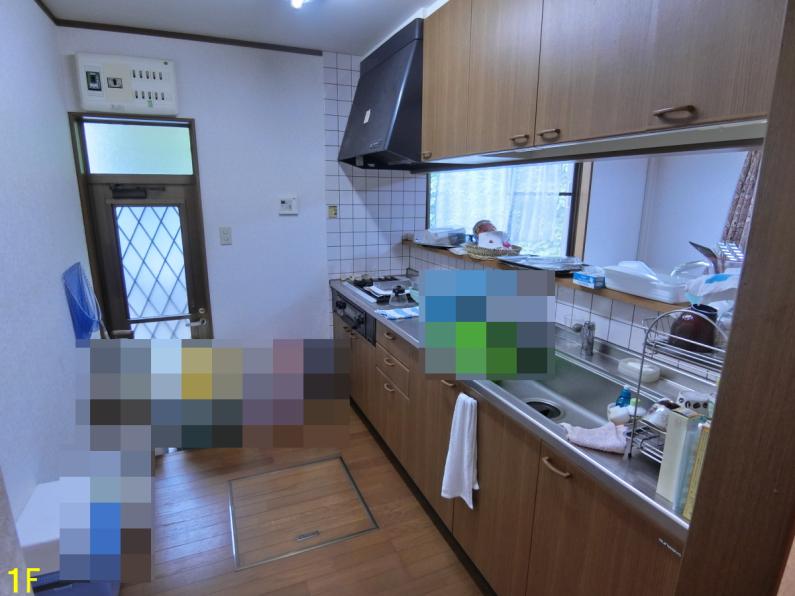
Identify the location of cook books. (668, 458), (684, 468), (693, 479).